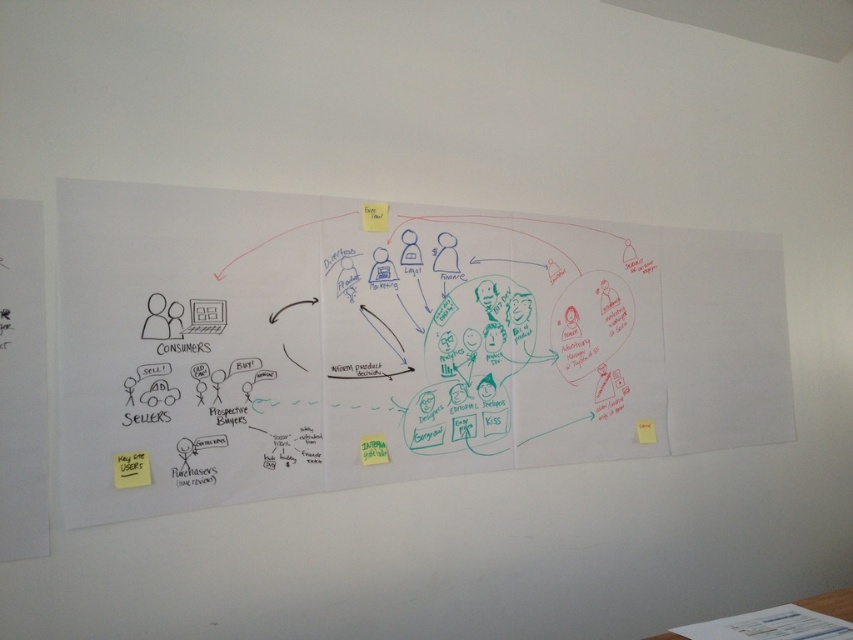
Between white paper at center and yellow paper at bottom right, which one appears on the left side from the viewer's perspective?

white paper at center

Is white paper at center thinner than yellow paper at bottom right?

No.

Between point (132, 435) and point (646, 419), which one is positioned behind?

Point (646, 419)

Find the location of a particular element. white paper at center is located at coordinates (392, 342).

Who is taller, white paper at center or green paper at center?

white paper at center is taller.

Which of these two, white paper at center or green paper at center, stands shorter?

green paper at center

Is point (486, 218) in front of point (369, 458)?

No, (486, 218) is further to viewer.

The height and width of the screenshot is (640, 853). Find the location of `white paper at center`. white paper at center is located at coordinates (392, 342).

Between white paper at center and yellow sticky note at lower left, which one is positioned higher?

white paper at center is above.

Between point (70, 449) and point (143, 461), which one is positioned behind?

The point (143, 461) is behind.

The height and width of the screenshot is (640, 853). What are the coordinates of `white paper at center` in the screenshot? It's located at (392, 342).